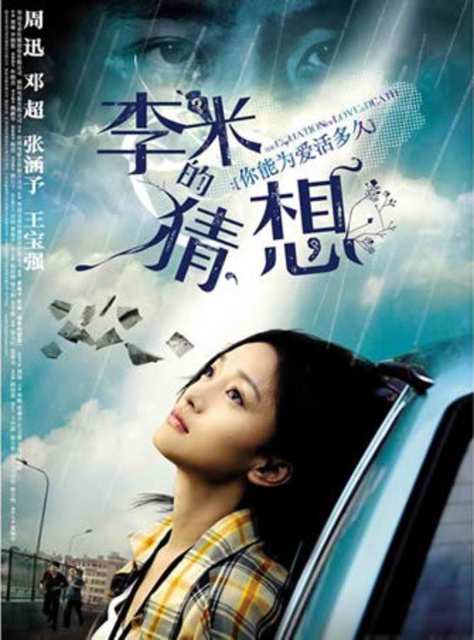
Question: Which point appears farthest from the camera in this image?

Choices:
 (A) (453, 420)
 (B) (233, 566)

Answer: (B)

Question: Is yellow plaid shirt at center thinner than transparent glass car window at lower right?

Choices:
 (A) no
 (B) yes

Answer: (A)

Question: Which of the following is the farthest from the observer?

Choices:
 (A) yellow plaid shirt at center
 (B) transparent glass car window at lower right

Answer: (A)

Question: Is the position of yellow plaid shirt at center more distant than that of transparent glass car window at lower right?

Choices:
 (A) no
 (B) yes

Answer: (B)

Question: Which object is closer to the camera taking this photo?

Choices:
 (A) yellow plaid shirt at center
 (B) transparent glass car window at lower right

Answer: (B)

Question: From the image, what is the correct spatial relationship of yellow plaid shirt at center in relation to transparent glass car window at lower right?

Choices:
 (A) below
 (B) above

Answer: (A)